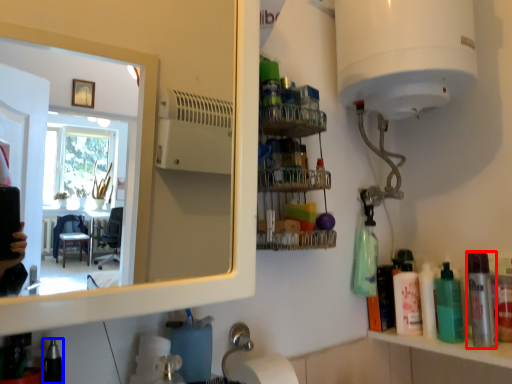
Question: Which point is further to the camera, mouthwash (highlighted by a red box) or toiletry (highlighted by a blue box)?

Choices:
 (A) mouthwash
 (B) toiletry

Answer: (A)